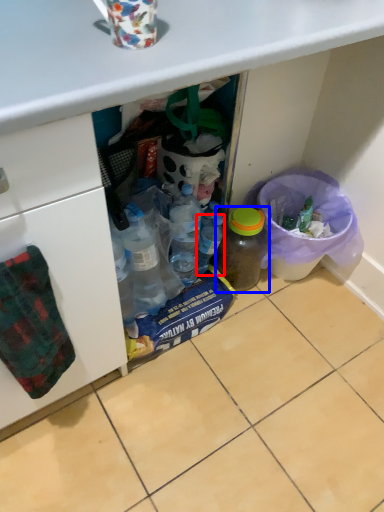
Question: Which point is closer to the camera, bottle (highlighted by a red box) or bottle (highlighted by a blue box)?

Choices:
 (A) bottle
 (B) bottle

Answer: (B)